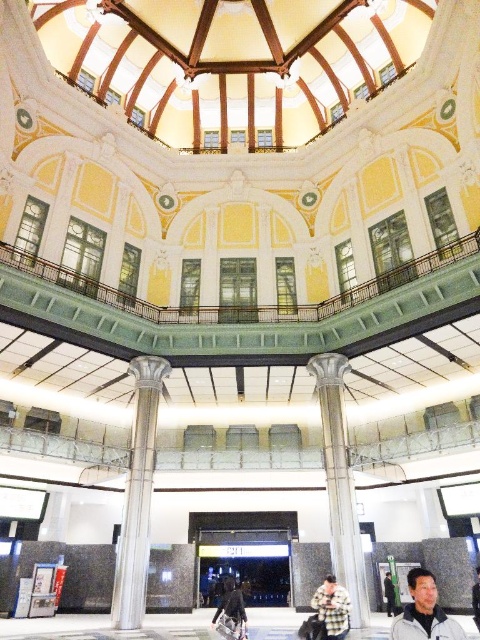
Is point (347, 564) behind point (228, 636)?

Yes, point (347, 564) is farther from viewer.

Does polished silver column at center have a larger size compared to dark gray fabric jacket at lower center?

No.

Locate an element on the screen. This screenshot has width=480, height=640. polished silver column at center is located at coordinates (339, 483).

Between gray fabric jacket at lower right and dark gray fabric jacket at lower center, which one has less height?

dark gray fabric jacket at lower center

Does point (436, 602) come behind point (240, 596)?

No, it is in front of (240, 596).

Does point (423, 572) come behind point (236, 596)?

No.

This screenshot has height=640, width=480. Find the location of `gray fabric jacket at lower right`. gray fabric jacket at lower right is located at coordinates (423, 612).

Which is more to the left, gray fabric jacket at lower right or fluffy beige coat at center?

fluffy beige coat at center

This screenshot has height=640, width=480. Describe the element at coordinates (423, 612) in the screenshot. I see `gray fabric jacket at lower right` at that location.

This screenshot has height=640, width=480. Identify the location of gray fabric jacket at lower right. (423, 612).